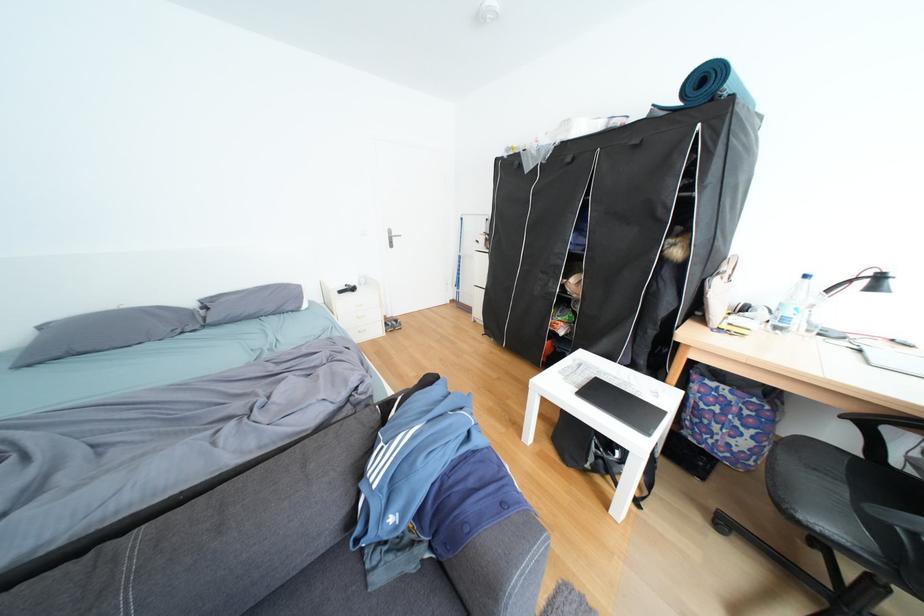
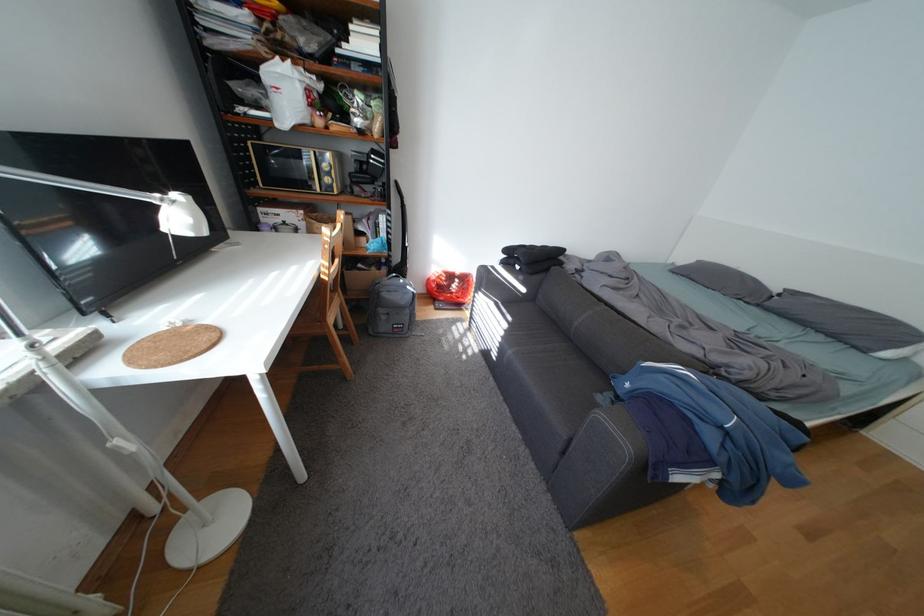
How did the camera likely rotate?

The rotation direction of the camera is left-down.